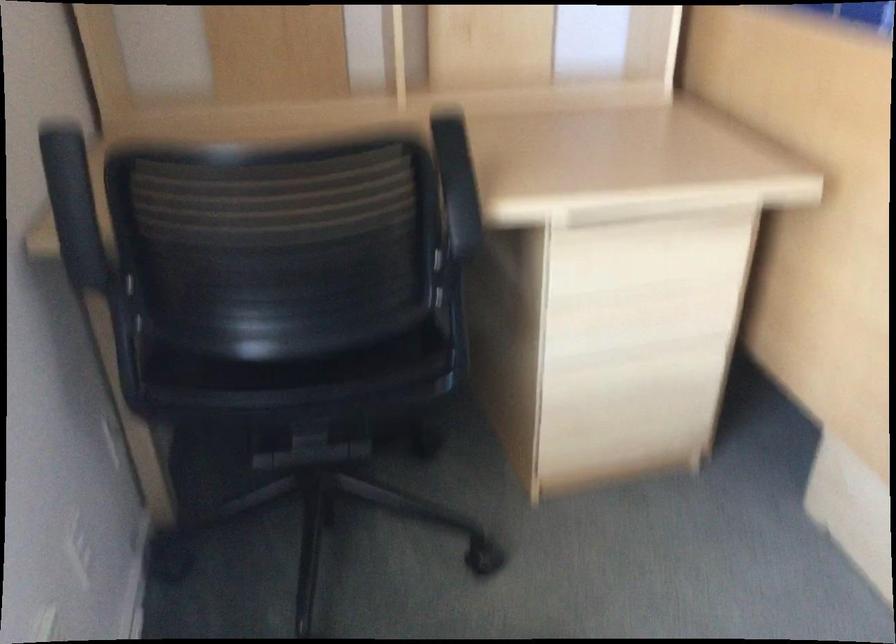
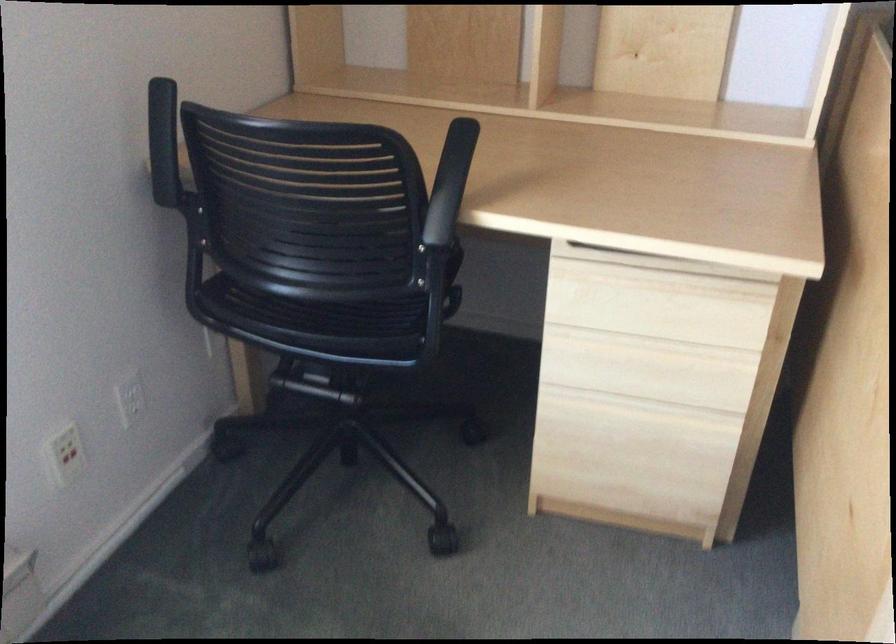
The point at (649, 297) is marked in the first image. Where is the corresponding point in the second image?

(652, 345)